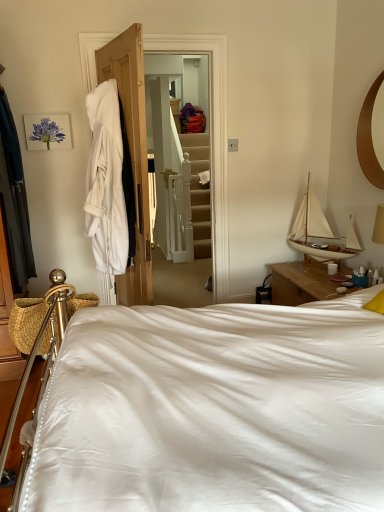
Question: Is matte purple flower at upper left shorter than white wood sailboat at upper right?

Choices:
 (A) no
 (B) yes

Answer: (B)

Question: Is matte purple flower at upper left aimed at white wood sailboat at upper right?

Choices:
 (A) yes
 (B) no

Answer: (B)

Question: Is matte purple flower at upper left outside of white wood sailboat at upper right?

Choices:
 (A) yes
 (B) no

Answer: (A)

Question: From the image's perspective, does matte purple flower at upper left appear lower than white wood sailboat at upper right?

Choices:
 (A) no
 (B) yes

Answer: (A)

Question: Does matte purple flower at upper left lie behind white wood sailboat at upper right?

Choices:
 (A) no
 (B) yes

Answer: (B)

Question: Visually, is dark blue fabric at left, the 1th clothing viewed from the left, positioned to the left or to the right of white cloth at left?

Choices:
 (A) left
 (B) right

Answer: (A)

Question: Do you think dark blue fabric at left, which is counted as the second clothing, starting from the right, is within white cloth at left, or outside of it?

Choices:
 (A) outside
 (B) inside

Answer: (A)

Question: From the image's perspective, is dark blue fabric at left, the 1th clothing viewed from the left, positioned above or below white cloth at left?

Choices:
 (A) below
 (B) above

Answer: (A)

Question: Considering the positions of dark blue fabric at left, which is counted as the second clothing, starting from the right, and white cloth at left in the image, is dark blue fabric at left, which is counted as the second clothing, starting from the right, taller or shorter than white cloth at left?

Choices:
 (A) tall
 (B) short

Answer: (B)

Question: Is wooden mirror at upper right situated inside white wood sailboat at upper right or outside?

Choices:
 (A) inside
 (B) outside

Answer: (B)

Question: Is point click(372, 183) closer or farther from the camera than point click(294, 225)?

Choices:
 (A) farther
 (B) closer

Answer: (B)

Question: From their relative heights in the image, would you say wooden mirror at upper right is taller or shorter than white wood sailboat at upper right?

Choices:
 (A) short
 (B) tall

Answer: (B)

Question: From a real-world perspective, is wooden mirror at upper right above or below white wood sailboat at upper right?

Choices:
 (A) above
 (B) below

Answer: (A)

Question: In the image, is white cloth at left positioned in front of or behind white ceramic mug at upper right?

Choices:
 (A) behind
 (B) front

Answer: (B)

Question: Considering the positions of white cloth at left and white ceramic mug at upper right in the image, is white cloth at left taller or shorter than white ceramic mug at upper right?

Choices:
 (A) short
 (B) tall

Answer: (B)